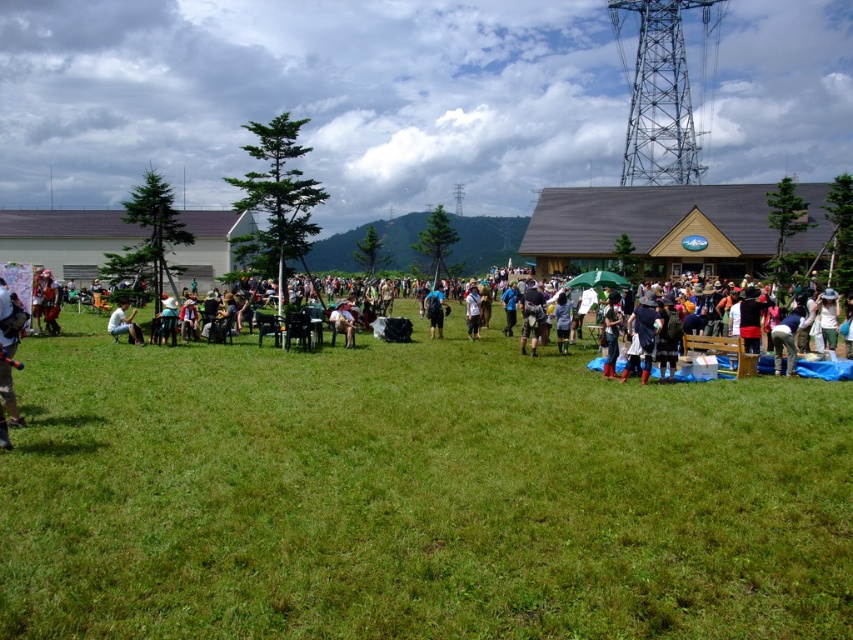
How far apart are matte black jacket at center and blue fabric bag at center?

A distance of 19.06 meters exists between matte black jacket at center and blue fabric bag at center.

Is point (134, 324) farther from camera compared to point (433, 308)?

No, it is not.

Identify the location of matte black jacket at center. (125, 323).

Based on the photo, who is taller, matte black jacket at left or light brown fabric chair at center?

With more height is matte black jacket at left.

This screenshot has width=853, height=640. I want to click on matte black jacket at left, so click(25, 282).

Between matte black jacket at center and white cotton shirt at center, which one has more height?

white cotton shirt at center is taller.

Which of these two, matte black jacket at center or white cotton shirt at center, stands shorter?

Standing shorter between the two is matte black jacket at center.

Locate an element on the screen. matte black jacket at center is located at coordinates (125, 323).